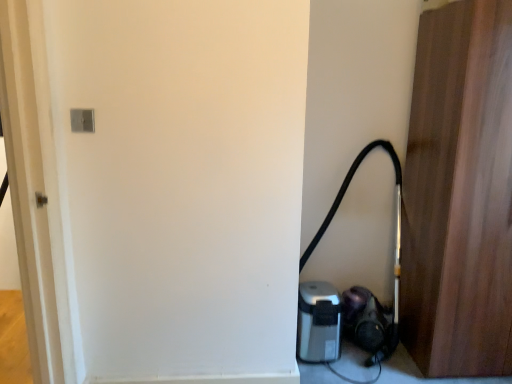
Question: From a real-world perspective, is wooden door at right located higher than silver metallic coffee maker at lower right?

Choices:
 (A) yes
 (B) no

Answer: (A)

Question: Is wooden door at right smaller than silver metallic coffee maker at lower right?

Choices:
 (A) no
 (B) yes

Answer: (A)

Question: Does wooden door at right contain silver metallic coffee maker at lower right?

Choices:
 (A) no
 (B) yes

Answer: (A)

Question: Is wooden door at right turned away from silver metallic coffee maker at lower right?

Choices:
 (A) yes
 (B) no

Answer: (B)

Question: Is wooden door at right bigger than silver metallic coffee maker at lower right?

Choices:
 (A) yes
 (B) no

Answer: (A)

Question: In terms of height, does wooden door at right look taller or shorter compared to silver metallic coffee maker at lower right?

Choices:
 (A) tall
 (B) short

Answer: (A)

Question: In terms of size, does wooden door at right appear bigger or smaller than silver metallic coffee maker at lower right?

Choices:
 (A) small
 (B) big

Answer: (B)

Question: Considering the relative positions of wooden door at right and silver metallic coffee maker at lower right in the image provided, is wooden door at right to the left or to the right of silver metallic coffee maker at lower right?

Choices:
 (A) right
 (B) left

Answer: (A)

Question: Considering the positions of point (506, 271) and point (316, 337), is point (506, 271) closer or farther from the camera than point (316, 337)?

Choices:
 (A) closer
 (B) farther

Answer: (A)

Question: Does point (343, 304) appear closer or farther from the camera than point (462, 51)?

Choices:
 (A) farther
 (B) closer

Answer: (A)

Question: Considering the positions of black rubber garden hose at lower right and wooden door at right in the image, is black rubber garden hose at lower right bigger or smaller than wooden door at right?

Choices:
 (A) big
 (B) small

Answer: (B)

Question: Is black rubber garden hose at lower right in front of or behind wooden door at right in the image?

Choices:
 (A) behind
 (B) front

Answer: (A)

Question: Considering the relative positions of black rubber garden hose at lower right and wooden door at right in the image provided, is black rubber garden hose at lower right to the left or to the right of wooden door at right?

Choices:
 (A) right
 (B) left

Answer: (B)

Question: Do you think silver metallic coffee maker at lower right is within wooden door at right, or outside of it?

Choices:
 (A) outside
 (B) inside

Answer: (A)

Question: In terms of height, does silver metallic coffee maker at lower right look taller or shorter compared to wooden door at right?

Choices:
 (A) short
 (B) tall

Answer: (A)